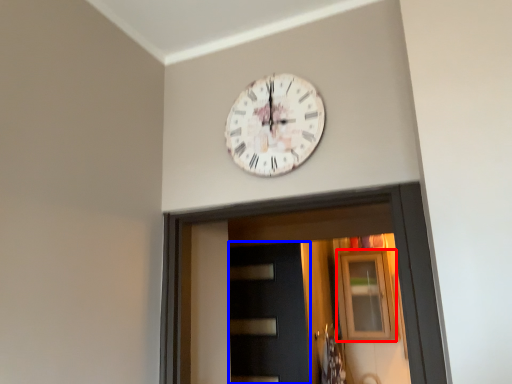
Question: Which point is further to the camera, window (highlighted by a red box) or door (highlighted by a blue box)?

Choices:
 (A) window
 (B) door

Answer: (A)